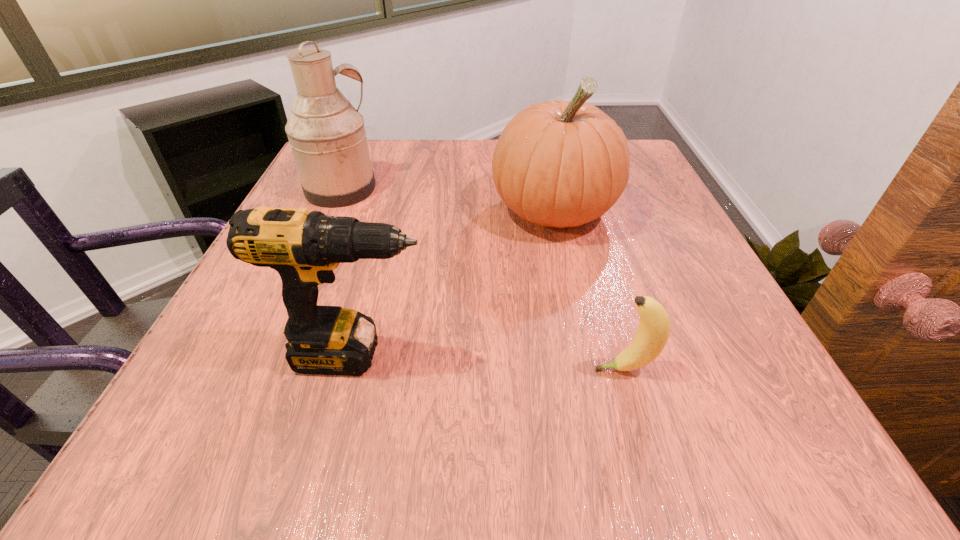
Find the location of `vacant position at the far right corner of the desktop`. vacant position at the far right corner of the desktop is located at coordinates (633, 141).

Where is `empty space that is in between the drill and the banana`? empty space that is in between the drill and the banana is located at coordinates (492, 362).

Find the location of a particular element. empty location between the pumpkin and the pitcher is located at coordinates pyautogui.click(x=447, y=200).

Identify the location of vacant area that lies between the pumpkin and the shortest object. This screenshot has height=540, width=960. (588, 290).

Find the location of a particular element. The image size is (960, 540). free space between the drill and the pitcher is located at coordinates (350, 272).

Where is `unoccupied position between the drill and the pitcher`? This screenshot has width=960, height=540. unoccupied position between the drill and the pitcher is located at coordinates (350, 272).

Where is `free spot between the drill and the shortest object`? This screenshot has width=960, height=540. free spot between the drill and the shortest object is located at coordinates (492, 362).

You are a GUI agent. You are given a task and a screenshot of the screen. Output one action in this format:
    pyautogui.click(x=<x>, y=<y>)
    Task: Click on the free space between the pumpkin and the drill
    The height and width of the screenshot is (540, 960).
    Given the screenshot: What is the action you would take?
    pyautogui.click(x=456, y=283)

Locate an element on the screen. Image resolution: width=960 pixels, height=540 pixels. free space that is in between the banana and the pitcher is located at coordinates (483, 279).

Image resolution: width=960 pixels, height=540 pixels. In order to click on vacant point located between the drill and the banana in this screenshot , I will do `click(492, 362)`.